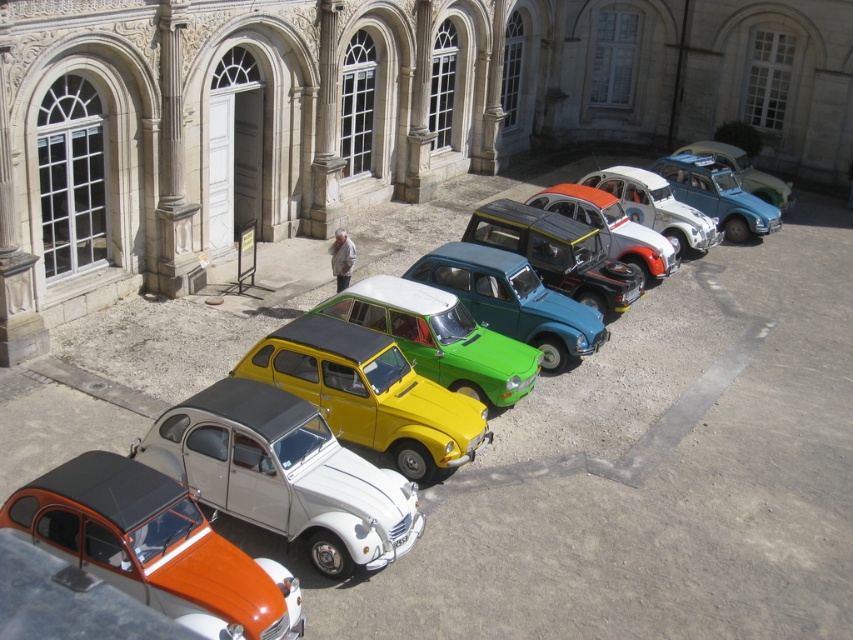
You are a tour guide leading a group to a parking lot where the matte black car at center and the metallic silver car at center are parked. The tour bus is 4 meters wide. Can the tour bus fit between the two cars?

The matte black car at center and the metallic silver car at center are 3.94 meters apart from each other, so the tour bus that is 4 meters wide cannot fit between them since the space is slightly narrower than the bus.

You are a photographer wanting to capture both the white matte car at center and the orange matte car at lower left in a single frame. Based on their positions, which car should you focus on first to ensure both are in the shot?

The white matte car at center is located above the orange matte car at lower left, so focusing on the white matte car at center first will allow you to frame the shot to include both cars in the composition.

You are a delivery person who needs to park a new car between the white matte car at center and the yellow matte toy car at center. Which car should you park closer to if the new car is taller than both?

The new car should be parked closer to the white matte car at center because it is shorter than the yellow matte toy car at center, so the height difference would be less noticeable there.